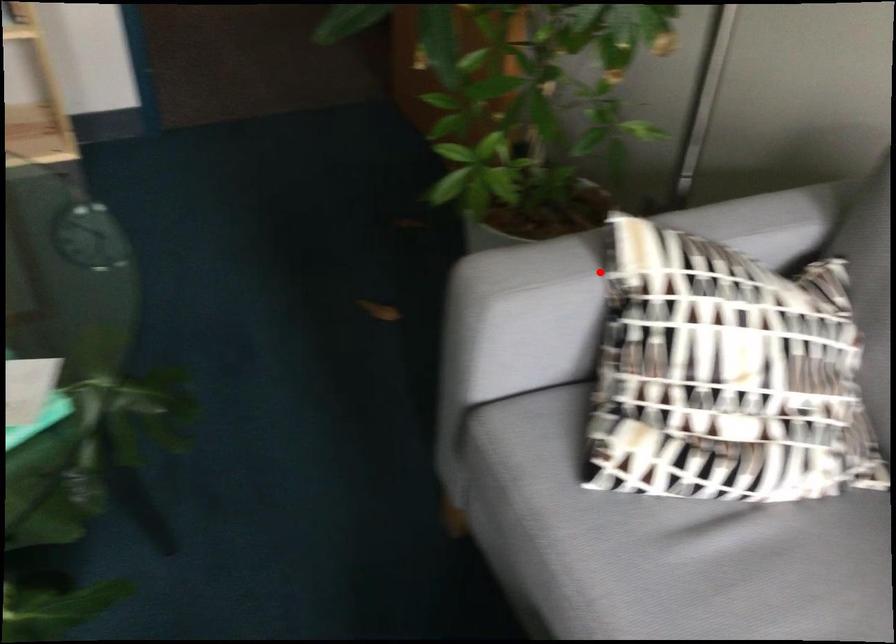
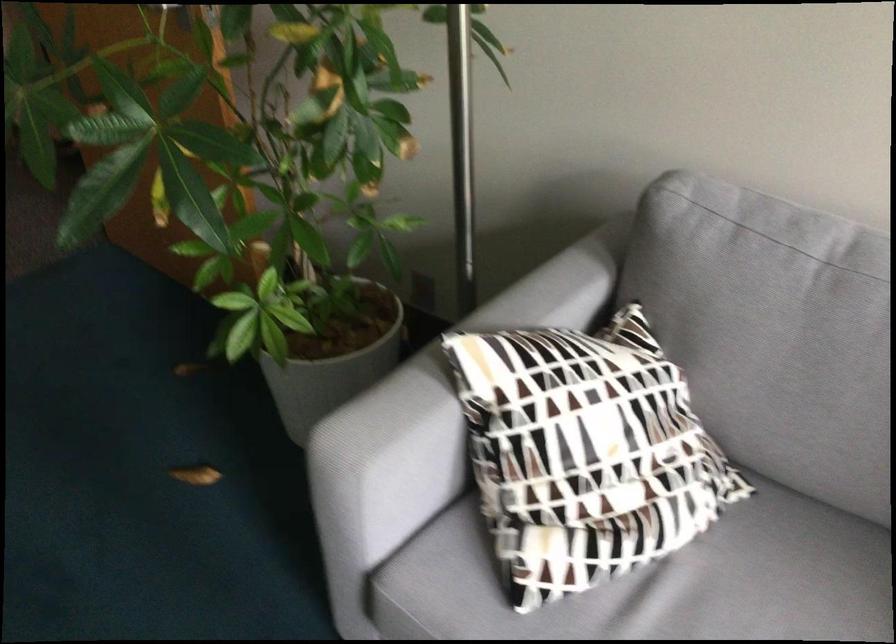
Find the pixel in the second image that matches the highlighted location in the first image.

(444, 397)